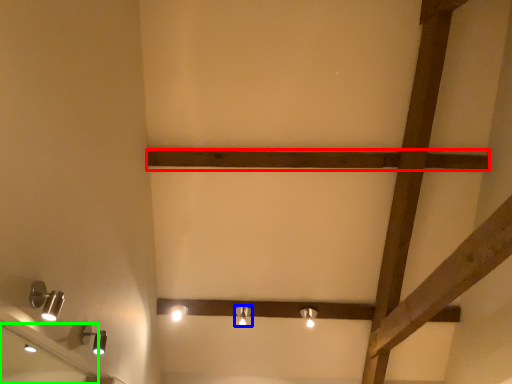
Question: Which object is the farthest from plank (highlighted by a red box)? Choose among these: lamp (highlighted by a blue box) or mirror (highlighted by a green box).

Choices:
 (A) lamp
 (B) mirror

Answer: (B)